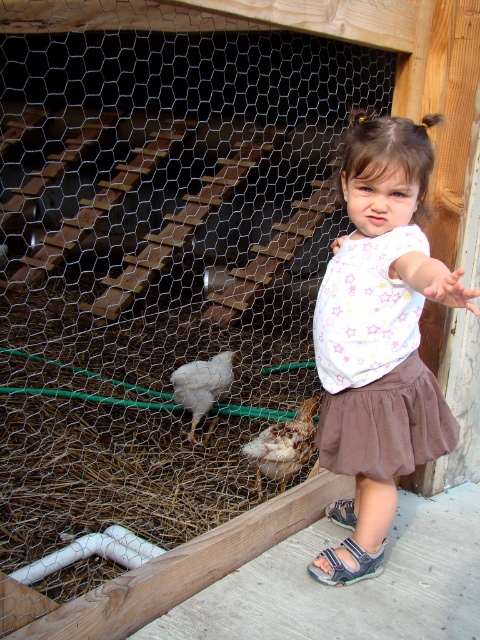
Question: Which of the following is the farthest from the observer?

Choices:
 (A) (217, 384)
 (B) (415, 449)
 (C) (325, 573)
 (D) (310, 410)

Answer: (A)

Question: Which object is closer to the camera taking this photo?

Choices:
 (A) white star-patterned shirt at center
 (B) white feathered chicken at center
 (C) blue fabric sandal at lower center
 (D) speckled feathered chicken at center

Answer: (A)

Question: Can you confirm if speckled feathered chicken at center is wider than white feathered chicken at center?

Choices:
 (A) yes
 (B) no

Answer: (A)

Question: Which object is closer to the camera taking this photo?

Choices:
 (A) speckled feathered chicken at center
 (B) white star-patterned shirt at center
 (C) blue fabric sandal at lower center
 (D) white feathered chicken at center

Answer: (B)

Question: Can you confirm if white star-patterned shirt at center is bigger than white feathered chicken at center?

Choices:
 (A) yes
 (B) no

Answer: (A)

Question: From the image, what is the correct spatial relationship of speckled feathered chicken at center in relation to white feathered chicken at center?

Choices:
 (A) right
 (B) left

Answer: (A)